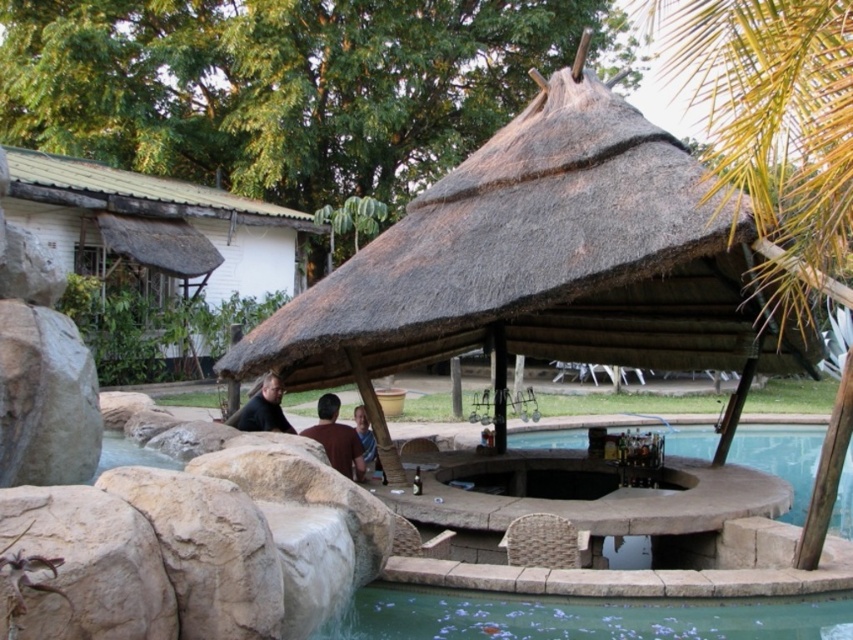
You are designing a layout for a new outdoor bar and want to place a brown leather chair at center and clear water at pool bottom. Based on the scene, which object takes up more space?

The brown leather chair at center takes up more space than the clear water at pool bottom because the clear water at pool bottom has a smaller size compared to brown leather chair at center.

You are a guest at this outdoor bar and want to take a photo of yourself with the green leafy palm tree at upper center in the background. Can you ensure the tree will be fully visible in the photo without any obstruction from the blue denim shirt at center?

The green leafy palm tree at upper center is not as tall as the blue denim shirt at center, so the tree might be partially obscured by the shirt if positioned between you and the tree. Adjust your angle to ensure the shirt doesn